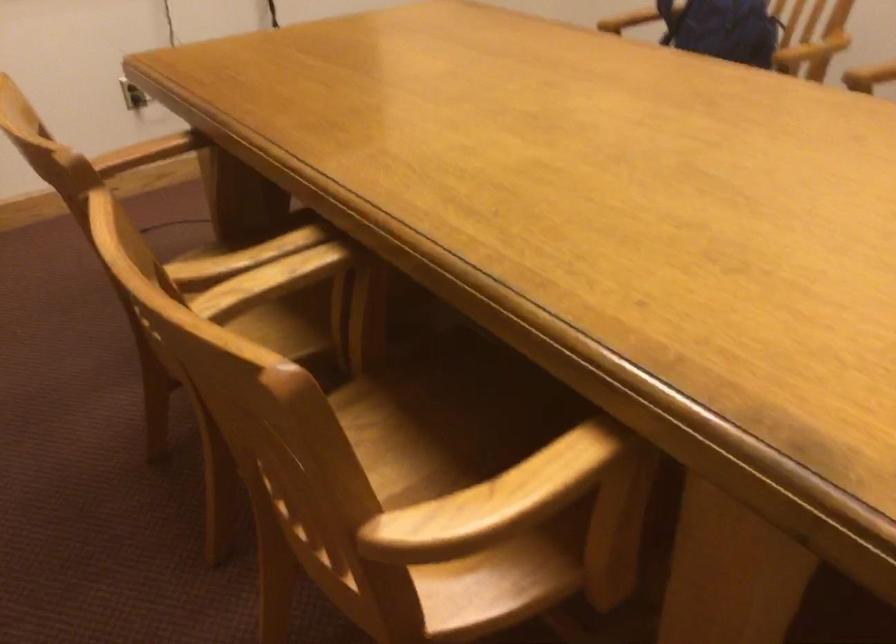
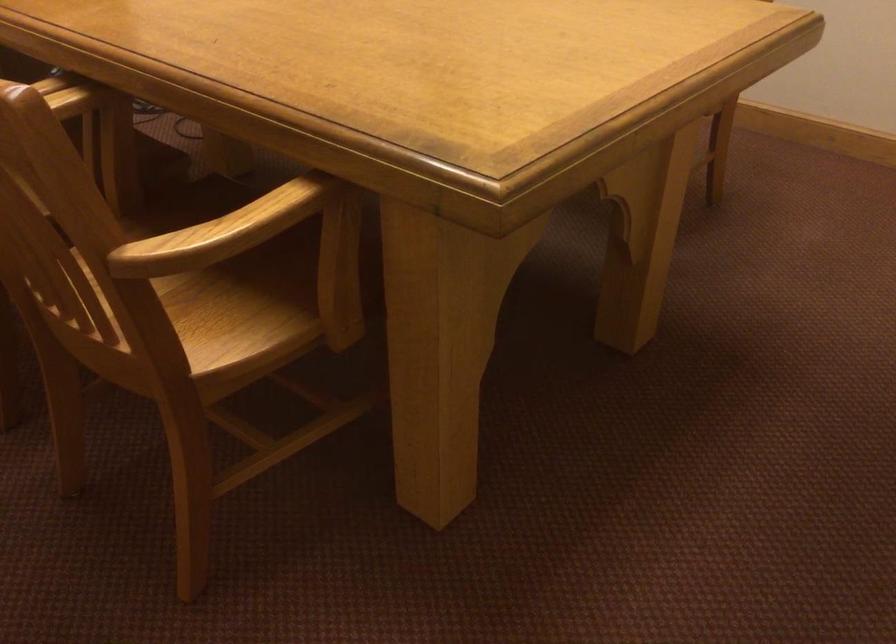
Question: How did the camera likely rotate?

Choices:
 (A) Left
 (B) Right
 (C) Up
 (D) Down

Answer: (B)